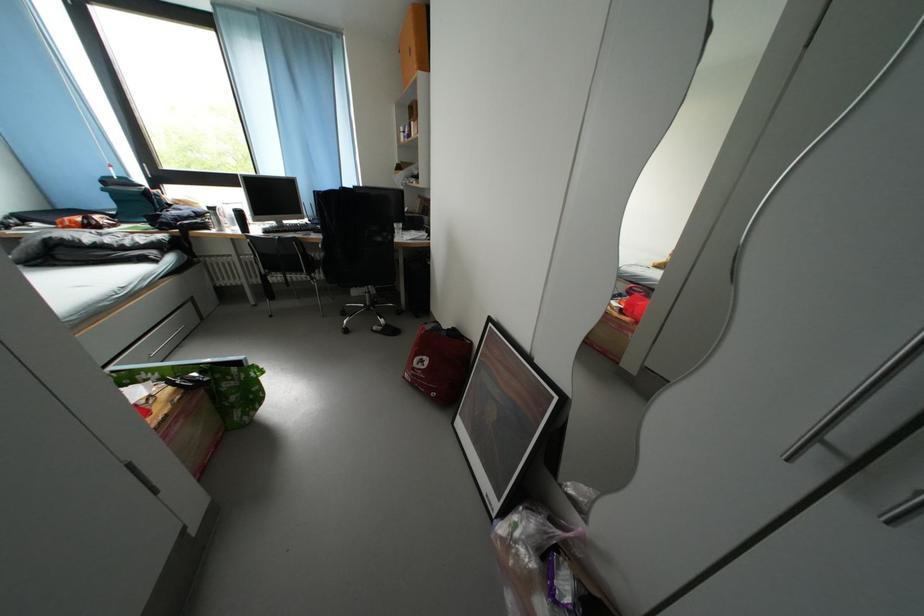
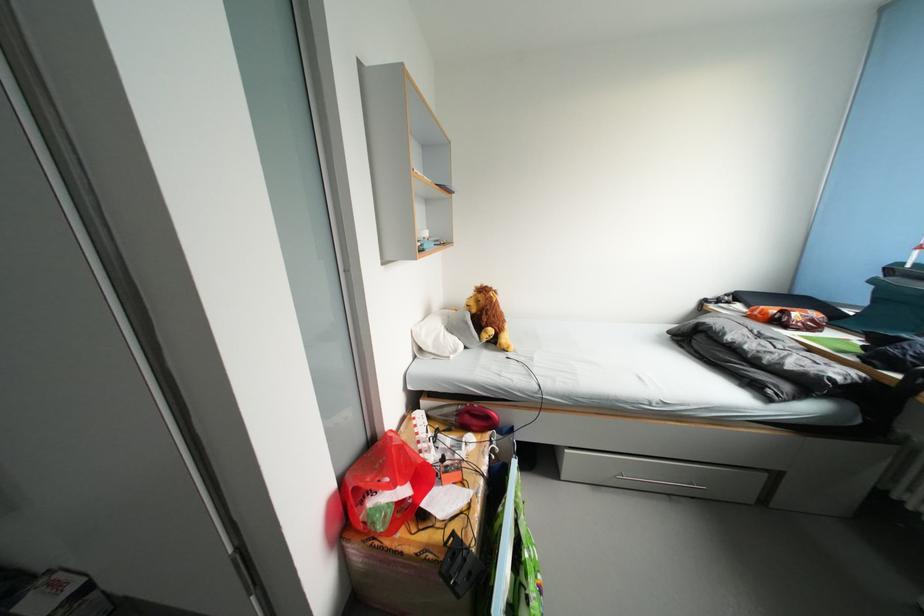
The point at (190, 397) is marked in the first image. Where is the corresponding point in the second image?

(450, 562)